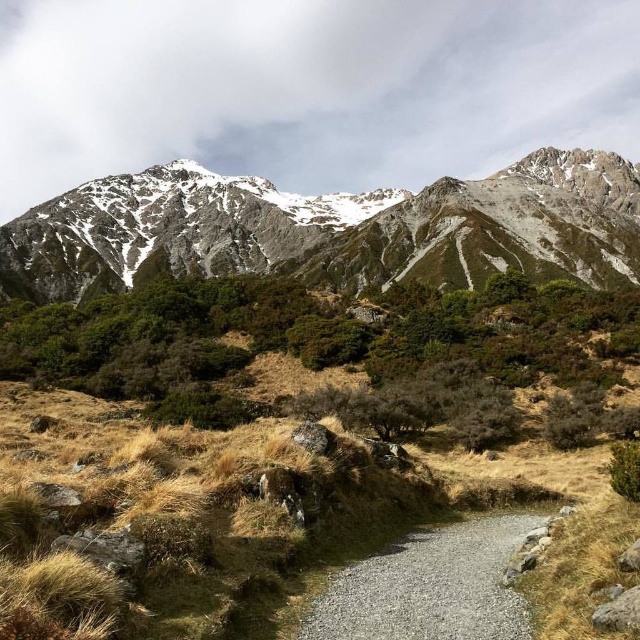
You are a hiker planning to follow the gravelly path at center towards the snowy granite mountain range at upper center. Based on the scene, will the path lead you directly to the base of the mountain range?

The snowy granite mountain range at upper center is positioned over the gravelly path at center, which suggests that the path leads directly towards the base of the mountain range. Therefore, following the path should guide you to the mountain base.

You are a hiker planning to follow the gravelly path at center towards the snowy granite mountain range at upper center. Based on the size difference between them, can you estimate how far the path might be from the mountain range?

The snowy granite mountain range at upper center is bigger than the gravelly path at center, but size does not directly indicate distance. The path could be far away even if the mountain appears larger due to perspective.